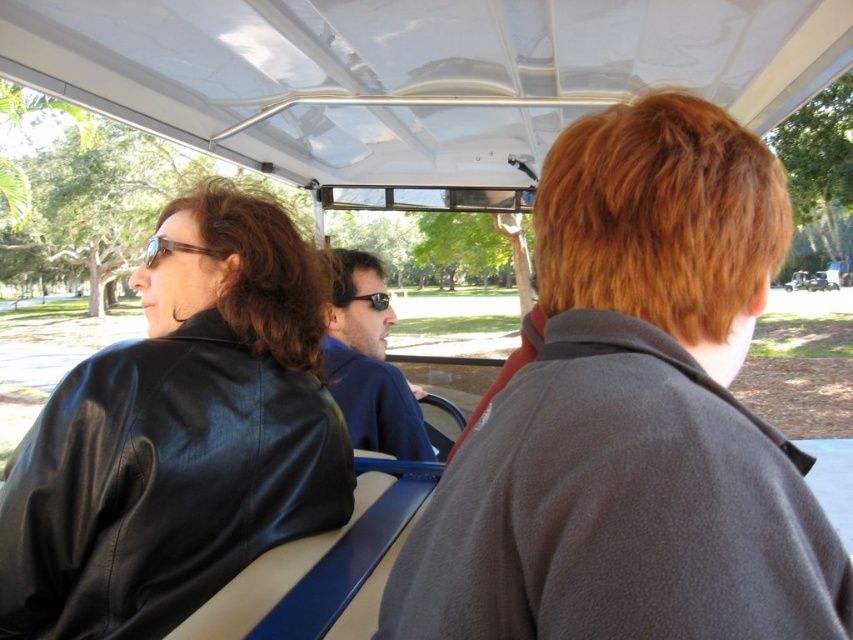
Question: Does matte black leather jacket at left appear on the left side of blue leather jacket at center?

Choices:
 (A) yes
 (B) no

Answer: (A)

Question: Is matte black leather jacket at left bigger than blue leather jacket at center?

Choices:
 (A) yes
 (B) no

Answer: (A)

Question: Estimate the real-world distances between objects in this image. Which object is closer to the matte black sunglasses at upper left?

Choices:
 (A) black plastic sunglasses at center
 (B) matte black leather jacket at left
 (C) blue leather jacket at center

Answer: (B)

Question: Which of these objects is positioned closest to the matte black leather jacket at left?

Choices:
 (A) matte black sunglasses at upper left
 (B) blue leather jacket at center
 (C) black plastic sunglasses at center
 (D) gray fleece jacket at center

Answer: (A)

Question: Among these points, which one is farthest from the camera?

Choices:
 (A) (314, 330)
 (B) (198, 244)
 (C) (360, 300)

Answer: (C)

Question: Does matte black leather jacket at left have a lesser width compared to black plastic sunglasses at center?

Choices:
 (A) yes
 (B) no

Answer: (B)